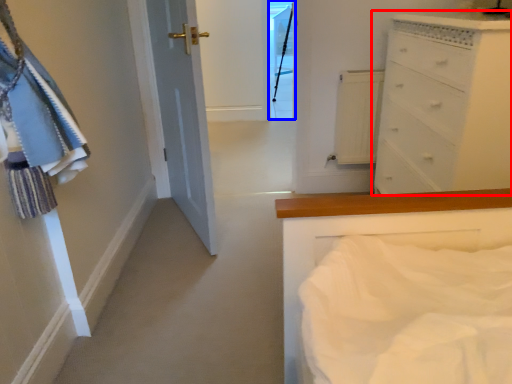
Question: Which object appears closest to the camera in this image, chest of drawers (highlighted by a red box) or glass door (highlighted by a blue box)?

Choices:
 (A) chest of drawers
 (B) glass door

Answer: (A)